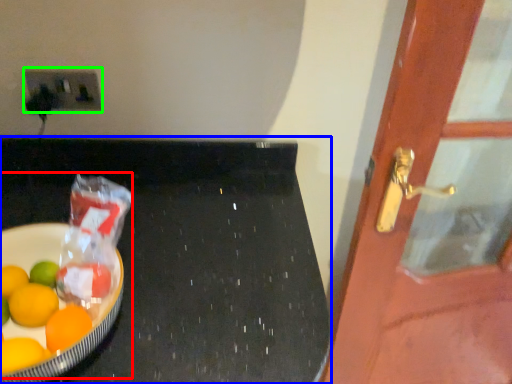
Question: Considering the real-world distances, which object is closest to fruit dish (highlighted by a red box)? table (highlighted by a blue box) or electric outlet (highlighted by a green box).

Choices:
 (A) table
 (B) electric outlet

Answer: (A)